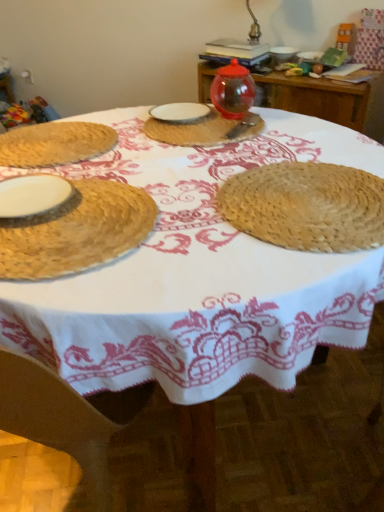
Find the location of a particular element. vacant area that is in front of white ceramic plate at center, the 2th tableware viewed from the back is located at coordinates (186, 136).